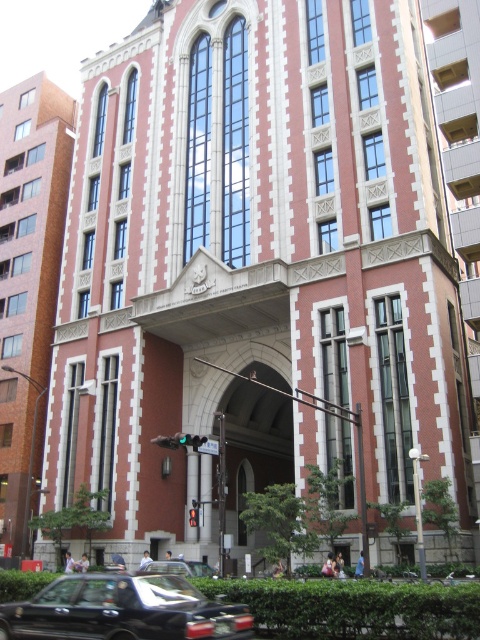
Question: Does shiny black car at lower left have a smaller size compared to black glossy car at center?

Choices:
 (A) no
 (B) yes

Answer: (A)

Question: Which point is closer to the camera taking this photo?

Choices:
 (A) (248, 621)
 (B) (141, 570)

Answer: (A)

Question: Which of the following is the closest to the observer?

Choices:
 (A) (103, 621)
 (B) (178, 564)

Answer: (A)

Question: Is shiny black car at lower left closer to camera compared to black glossy car at center?

Choices:
 (A) yes
 (B) no

Answer: (A)

Question: Can you confirm if shiny black car at lower left is positioned above black glossy car at center?

Choices:
 (A) no
 (B) yes

Answer: (B)